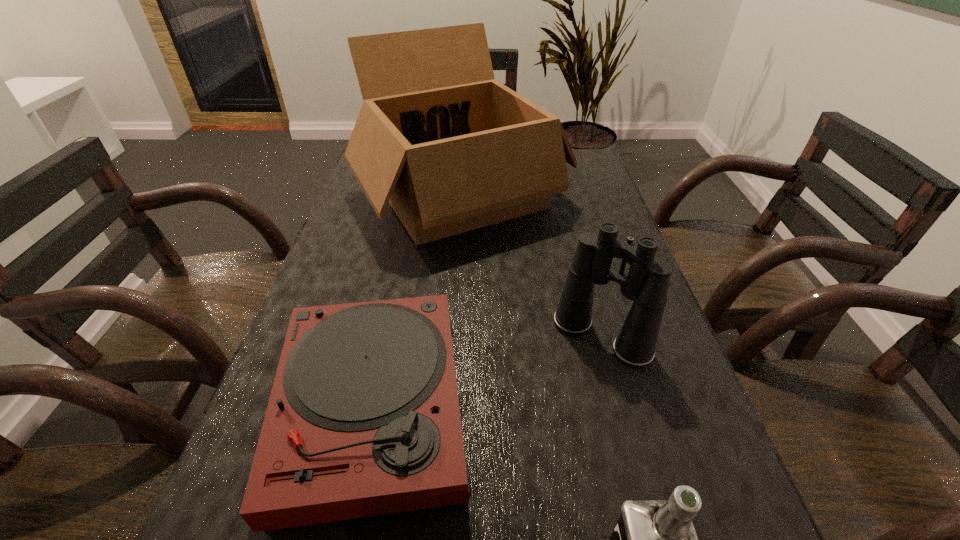
Identify the location of object that is the closest to the binoculars. The height and width of the screenshot is (540, 960). tap(451, 149).

You are a GUI agent. You are given a task and a screenshot of the screen. Output one action in this format:
    pyautogui.click(x=<x>, y=<y>)
    Task: Click on the object that ranks as the second closest to the binoculars
    
    Given the screenshot: What is the action you would take?
    pyautogui.click(x=363, y=419)

Where is `vacant point that satisfies the following two spatial constraints: 1. on the back side of the box; 2. on the left side of the shortest object`? The height and width of the screenshot is (540, 960). vacant point that satisfies the following two spatial constraints: 1. on the back side of the box; 2. on the left side of the shortest object is located at coordinates (417, 196).

In order to click on free space that satisfies the following two spatial constraints: 1. on the back side of the binoculars; 2. on the right side of the record player in this screenshot , I will do `click(387, 337)`.

Identify the location of free spot that satisfies the following two spatial constraints: 1. on the back side of the farthest object; 2. on the right side of the shortest object. Image resolution: width=960 pixels, height=540 pixels. (417, 196).